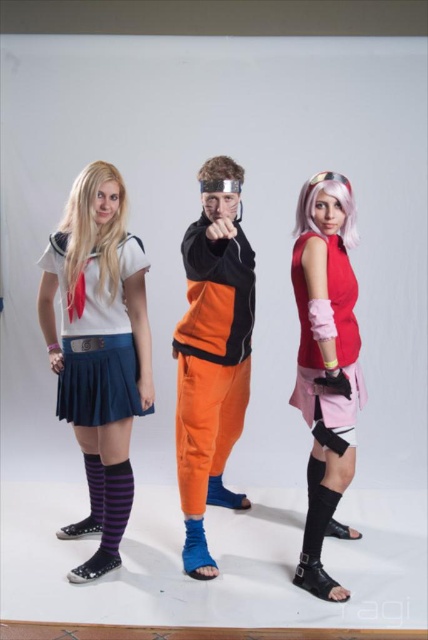
Question: Is satin white blouse at center smaller than blue fabric sock at center?

Choices:
 (A) no
 (B) yes

Answer: (A)

Question: Is orange fabric pants at center bigger than matte red shirt at right?

Choices:
 (A) yes
 (B) no

Answer: (A)

Question: Which of these objects is positioned closest to the blue fabric sock at center?

Choices:
 (A) matte red shirt at right
 (B) orange fabric pants at center

Answer: (B)

Question: Which object is closer to the camera taking this photo?

Choices:
 (A) purple striped sock at lower left
 (B) matte red shirt at right

Answer: (B)

Question: Is orange fabric pants at center closer to camera compared to matte red shirt at right?

Choices:
 (A) no
 (B) yes

Answer: (B)

Question: Which point is closer to the camera?

Choices:
 (A) (193, 536)
 (B) (115, 547)
 (C) (231, 420)
 (D) (68, 348)

Answer: (D)